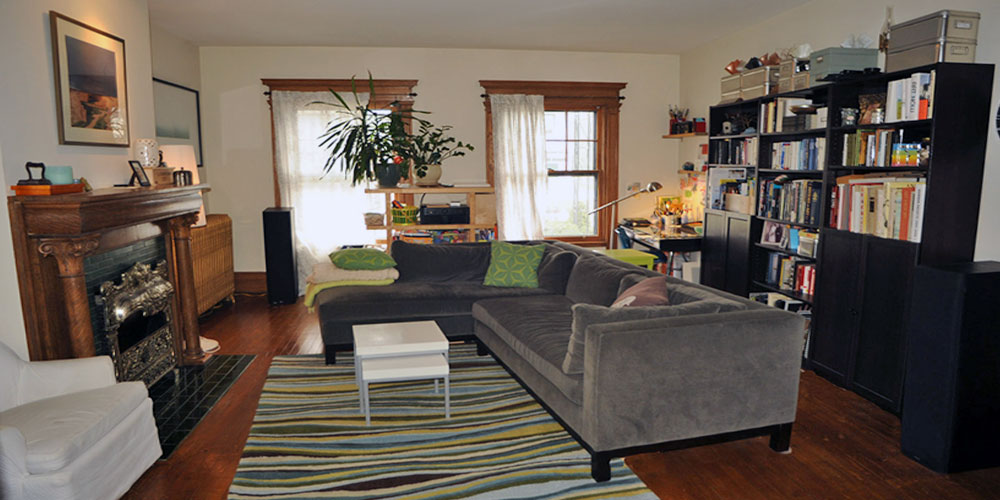
Find the location of a particular element. The height and width of the screenshot is (500, 1000). book shelf is located at coordinates (801, 207).